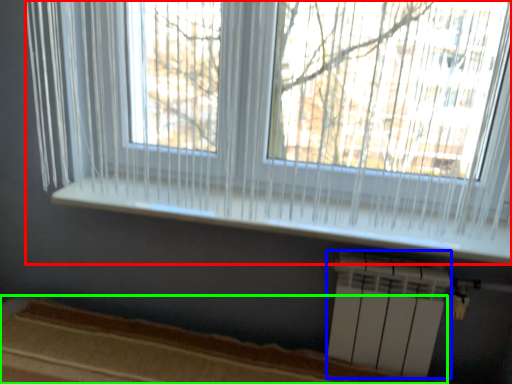
Question: Which object is the farthest from window (highlighted by a red box)? Choose among these: air conditioning (highlighted by a blue box) or bed frame (highlighted by a green box).

Choices:
 (A) air conditioning
 (B) bed frame

Answer: (B)